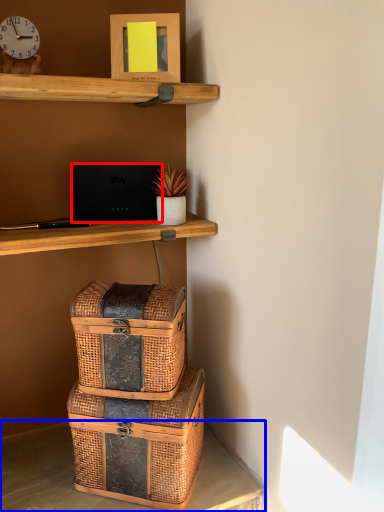
Question: Which object is closer to the camera taking this photo, laptop (highlighted by a red box) or desk (highlighted by a blue box)?

Choices:
 (A) laptop
 (B) desk

Answer: (B)